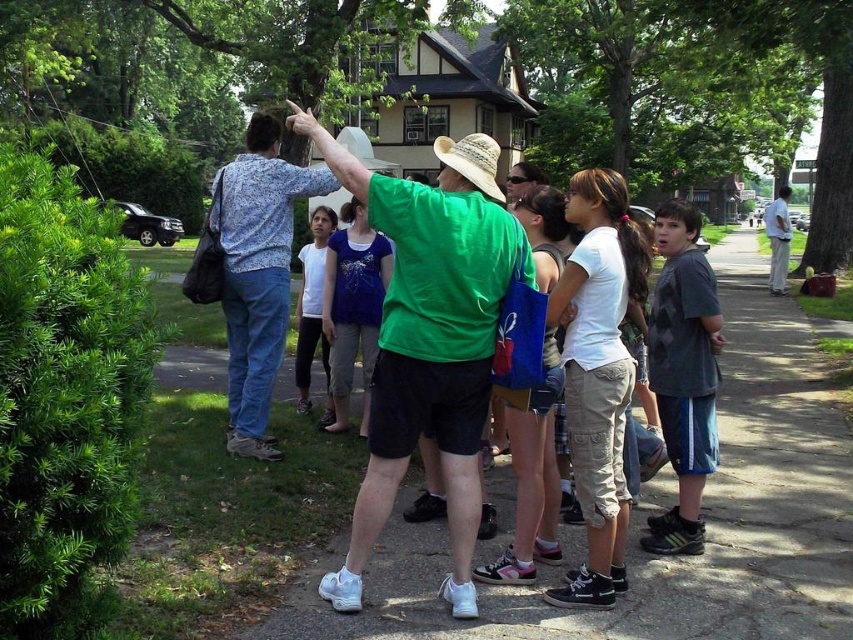
Who is lower down, straw cowboy hat at center or straw hat at center?

straw cowboy hat at center

From the picture: Which of these two, straw cowboy hat at center or straw hat at center, stands shorter?

Standing shorter between the two is straw cowboy hat at center.

Which is behind, point (474, 243) or point (491, 179)?

The point (491, 179) is behind.

Locate an element on the screen. The width and height of the screenshot is (853, 640). straw cowboy hat at center is located at coordinates (425, 349).